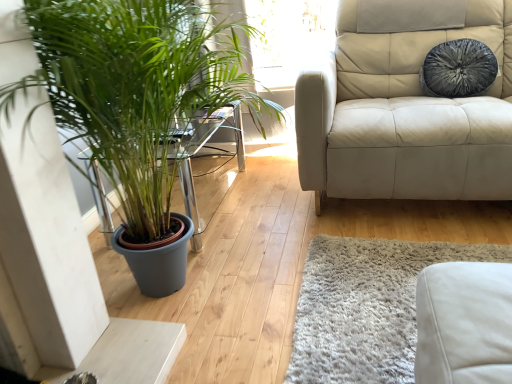
Locate an element on the screen. This screenshot has height=384, width=512. vacant area that is situated to the right of green matte plant at left is located at coordinates (371, 258).